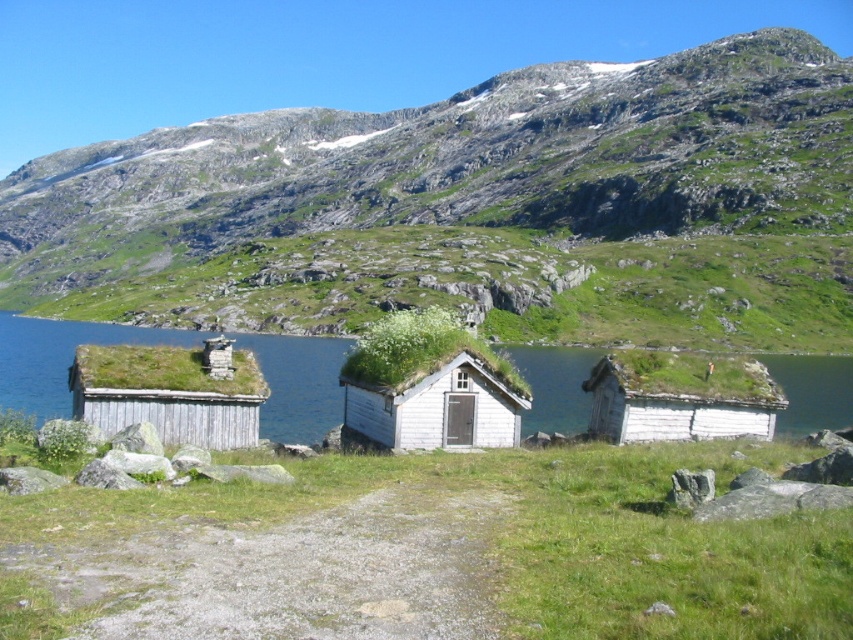
Can you confirm if green mossy grass at center is positioned to the right of green moss-covered cottage at center?

Correct, you'll find green mossy grass at center to the right of green moss-covered cottage at center.

I want to click on green mossy grass at center, so click(x=549, y=536).

This screenshot has height=640, width=853. Find the location of `green mossy grass at center`. green mossy grass at center is located at coordinates (549, 536).

Does blue water at center appear on the right side of white wooden cottage at right?

No, blue water at center is not to the right of white wooden cottage at right.

Describe the element at coordinates (59, 356) in the screenshot. This screenshot has width=853, height=640. I see `blue water at center` at that location.

Is point (598, 356) positioned behind point (637, 436)?

Yes.

Identify the location of blue water at center. 59,356.

Does green grassy mountain at upper center have a lesser height compared to green moss-covered cottage at center?

No.

Is point (109, 177) farther from viewer compared to point (462, 368)?

Yes, point (109, 177) is behind point (462, 368).

Find the location of `green grassy mountain at upper center`. green grassy mountain at upper center is located at coordinates (474, 208).

The width and height of the screenshot is (853, 640). I want to click on green grassy mountain at upper center, so click(474, 208).